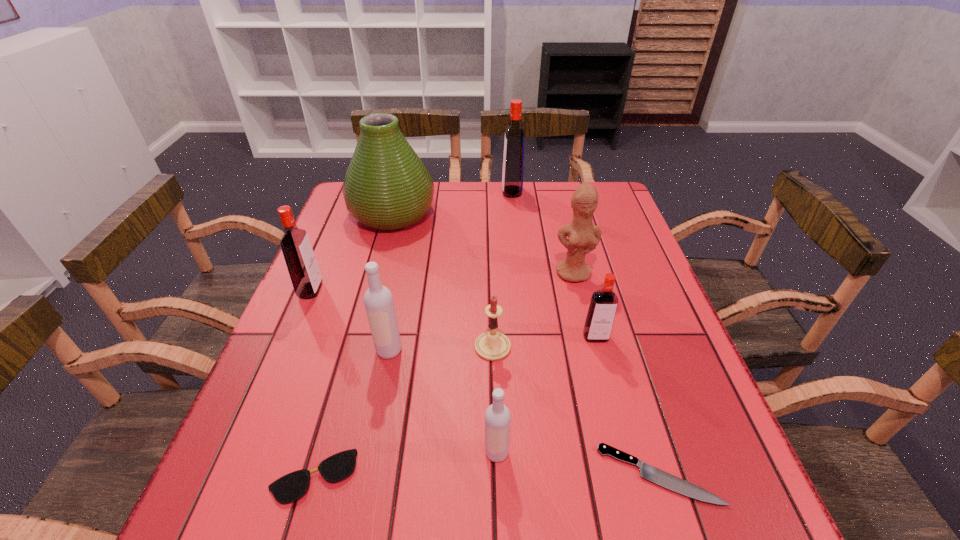
At what (x,y) coordinates should I click in order to perform the action: click on spectacles located at the near edge. Please return your answer as a coordinate pair (x, y). Image resolution: width=960 pixels, height=540 pixels. Looking at the image, I should click on (290, 487).

Locate an element on the screen. This screenshot has height=540, width=960. steak knife present at the near edge is located at coordinates (648, 472).

Where is `vase located in the left edge section of the desktop`? Image resolution: width=960 pixels, height=540 pixels. vase located in the left edge section of the desktop is located at coordinates coord(386,187).

Locate an element on the screen. The width and height of the screenshot is (960, 540). vodka located at the left edge is located at coordinates (302, 265).

I want to click on spectacles that is at the left edge, so click(290, 487).

The width and height of the screenshot is (960, 540). Identify the location of figurine at the right edge. (x=583, y=236).

Locate an element on the screen. Image resolution: width=960 pixels, height=540 pixels. vodka that is at the right edge is located at coordinates (601, 313).

At what (x,y) coordinates should I click in order to perform the action: click on steak knife present at the right edge. Please return your answer as a coordinate pair (x, y). Looking at the image, I should click on (648, 472).

Locate an element on the screen. object present at the far left corner is located at coordinates (386, 187).

I want to click on object at the near left corner, so click(x=290, y=487).